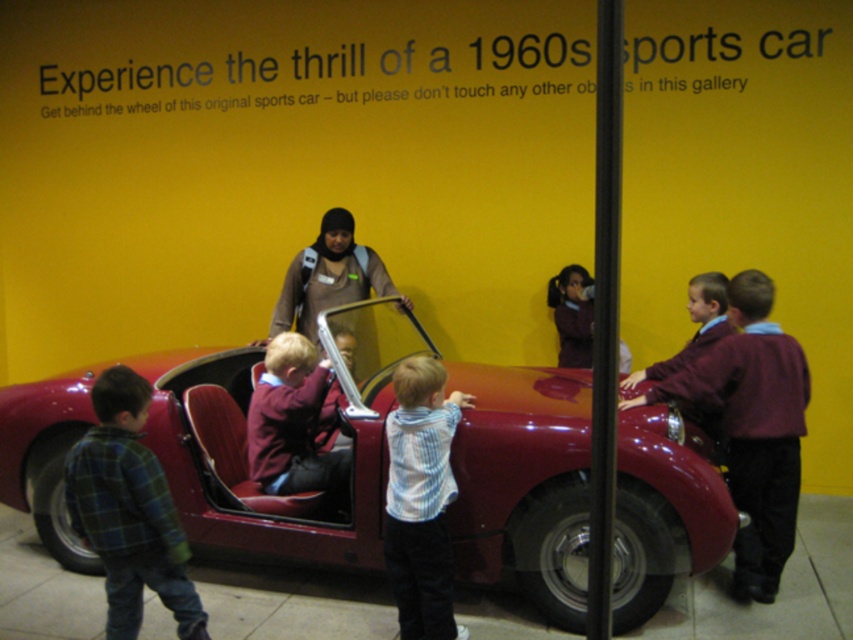
Can you confirm if maroon sweater at right is shorter than green plaid shirt at lower left?

No, maroon sweater at right is not shorter than green plaid shirt at lower left.

Can you confirm if maroon sweater at right is wider than green plaid shirt at lower left?

Yes.

Which is in front, point (724, 408) or point (119, 381)?

Positioned in front is point (119, 381).

Find the location of `maroon sweater at right`. maroon sweater at right is located at coordinates [x=752, y=426].

Who is taller, maroon sweater at right or maroon fabric jacket at center?

With more height is maroon sweater at right.

Locate an element on the screen. Image resolution: width=853 pixels, height=640 pixels. maroon sweater at right is located at coordinates (752, 426).

Does shiny red car at center have a smaller size compared to maroon fabric jacket at center?

No.

Who is shorter, shiny red car at center or maroon fabric jacket at center?

With less height is maroon fabric jacket at center.

Between point (625, 509) and point (283, 456), which one is positioned behind?

Positioned behind is point (283, 456).

Locate an element on the screen. The image size is (853, 640). shiny red car at center is located at coordinates (244, 442).